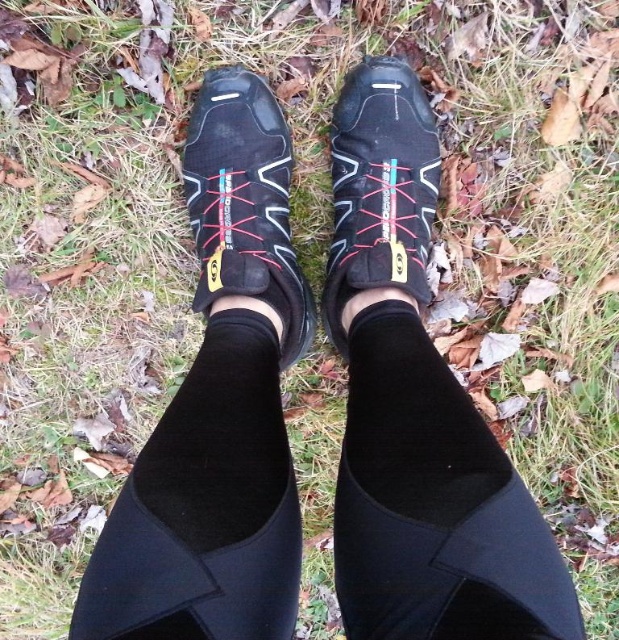
Can you confirm if black mesh shoe at center is positioned below matte black shoe at center?

Yes, black mesh shoe at center is below matte black shoe at center.

In the scene shown: Measure the distance from black mesh shoe at center to matte black shoe at center.

The distance of black mesh shoe at center from matte black shoe at center is 6.30 inches.

I want to click on black mesh shoe at center, so click(x=245, y=204).

Where is `black mesh shoe at center`? black mesh shoe at center is located at coordinates (245, 204).

What do you see at coordinates (204, 508) in the screenshot? I see `black spandex sock at center` at bounding box center [204, 508].

You are a GUI agent. You are given a task and a screenshot of the screen. Output one action in this format:
    pyautogui.click(x=<x>, y=<y>)
    Task: Click on the black spandex sock at center
    
    Given the screenshot: What is the action you would take?
    pyautogui.click(x=204, y=508)

This screenshot has height=640, width=619. Identify the location of black spandex sock at center. (204, 508).

At what (x,y) coordinates should I click in order to perform the action: click on black spandex sock at center. Please return your answer as a coordinate pair (x, y). This screenshot has width=619, height=640. Looking at the image, I should click on (204, 508).

Can you confirm if black smooth sock at center is smaller than black spandex sock at center?

No, black smooth sock at center is not smaller than black spandex sock at center.

Who is more forward, (358, 545) or (235, 410)?

Point (358, 545)

Locate an element on the screen. The image size is (619, 640). black smooth sock at center is located at coordinates (435, 506).